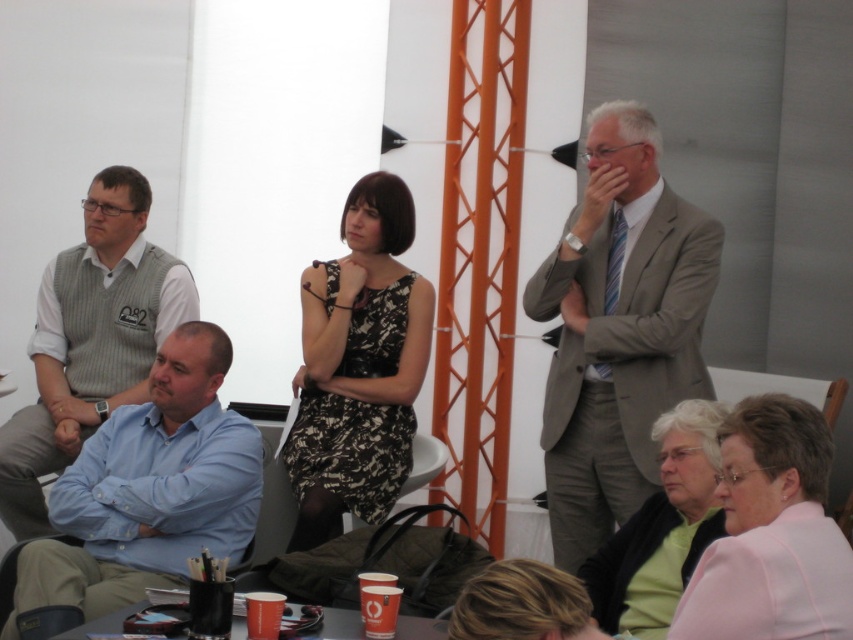
Question: Is blue shirt at center smaller than black plastic table at lower center?

Choices:
 (A) yes
 (B) no

Answer: (B)

Question: Which of the following is the closest to the observer?

Choices:
 (A) (540, 264)
 (B) (700, 456)

Answer: (B)

Question: Is light brown suit at center wider than light blue shirt at center?

Choices:
 (A) yes
 (B) no

Answer: (B)

Question: Can you confirm if blue shirt at center is positioned to the left of white plastic chair at center?

Choices:
 (A) no
 (B) yes

Answer: (B)

Question: Among these points, which one is nearest to the camera?

Choices:
 (A) (701, 525)
 (B) (134, 483)

Answer: (A)

Question: Which point appears closest to the camera in this image?

Choices:
 (A) (686, 572)
 (B) (352, 508)

Answer: (A)